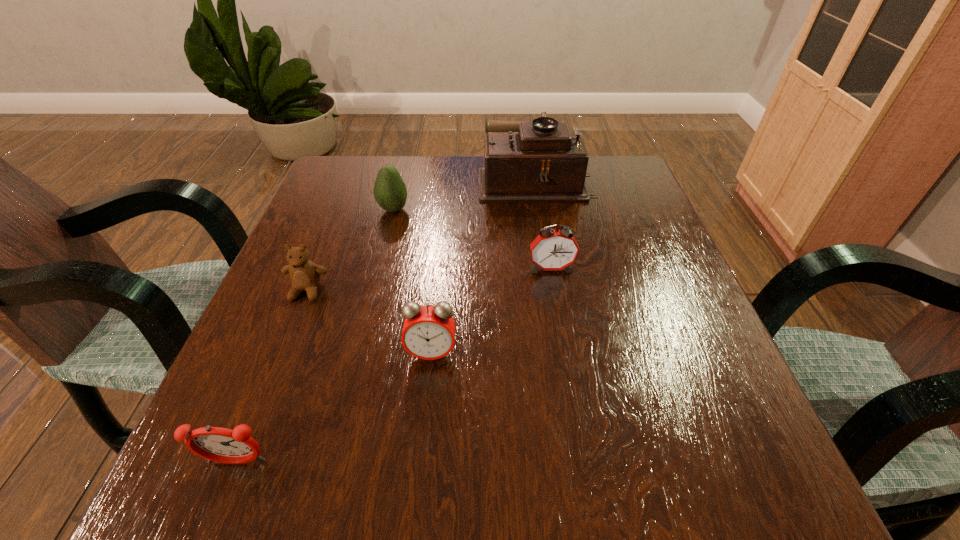
The image size is (960, 540). I want to click on phonograph_record, so click(540, 161).

Find the location of a particular element. This screenshot has width=960, height=540. the third object from left to right is located at coordinates (390, 192).

Find the location of a particular element. the rightmost alarm clock is located at coordinates (552, 250).

The height and width of the screenshot is (540, 960). I want to click on the farthest alarm clock, so click(x=552, y=250).

Find the location of a particular element. the second alarm clock from right to left is located at coordinates (428, 333).

Where is `the second nearest object`? This screenshot has height=540, width=960. the second nearest object is located at coordinates (428, 333).

The image size is (960, 540). In order to click on the third nearest object in this screenshot , I will do `click(305, 275)`.

I want to click on the nearest alarm clock, so click(x=217, y=444).

The height and width of the screenshot is (540, 960). What are the coordinates of `the nearest object` in the screenshot? It's located at (217, 444).

You are a GUI agent. You are given a task and a screenshot of the screen. Output one action in this format:
    pyautogui.click(x=<x>, y=<y>)
    Task: Click on the vacant space situated 0.080m on the horn of the tallest object
    
    Given the screenshot: What is the action you would take?
    pyautogui.click(x=446, y=179)